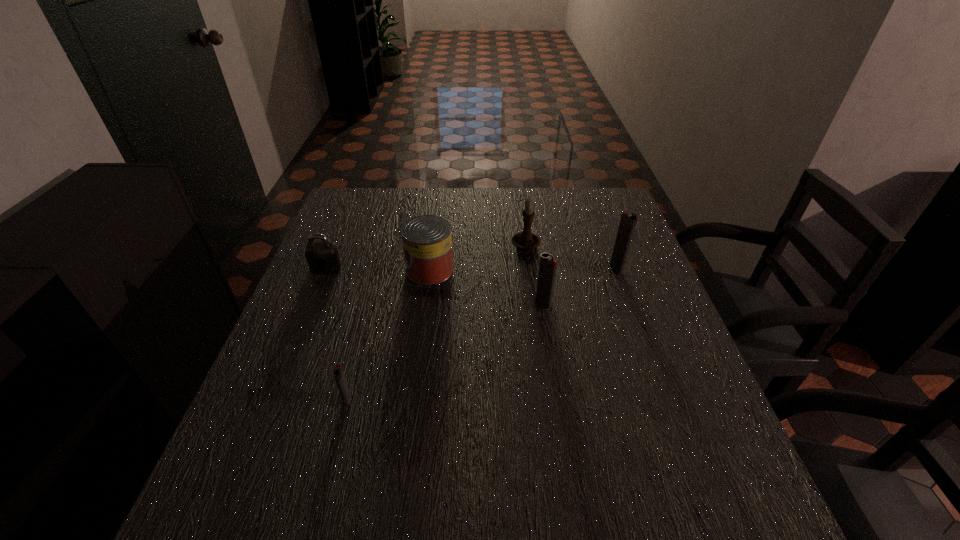
At what (x,y) coordinates should I click in order to perform the action: click on vacant area located 0.240m on the right of the second igniter from right to left. Please return your answer as a coordinate pair (x, y). Looking at the image, I should click on (649, 304).

Where is `vacant point located on the left of the rightmost object`? The height and width of the screenshot is (540, 960). vacant point located on the left of the rightmost object is located at coordinates (592, 268).

Identify the location of vacant region located at the front of the padlock near the keyhole. (296, 343).

Where is `free space located 0.170m on the left of the can`? free space located 0.170m on the left of the can is located at coordinates (343, 270).

You are a GUI agent. You are given a task and a screenshot of the screen. Output one action in this format:
    pyautogui.click(x=<x>, y=<y>)
    Task: Click on the free space located 0.170m on the side of the candle holder with the handle
    The image size is (960, 540).
    Given the screenshot: What is the action you would take?
    pyautogui.click(x=534, y=300)

Locate an element on the screen. object present at the left edge is located at coordinates (322, 257).

Identify the location of object that is at the right edge. (628, 221).

I want to click on vacant region at the far edge, so point(454,195).

The height and width of the screenshot is (540, 960). What are the coordinates of `vacant area at the near edge of the desktop` in the screenshot? It's located at (521, 427).

I want to click on vacant space at the left edge of the desktop, so click(289, 413).